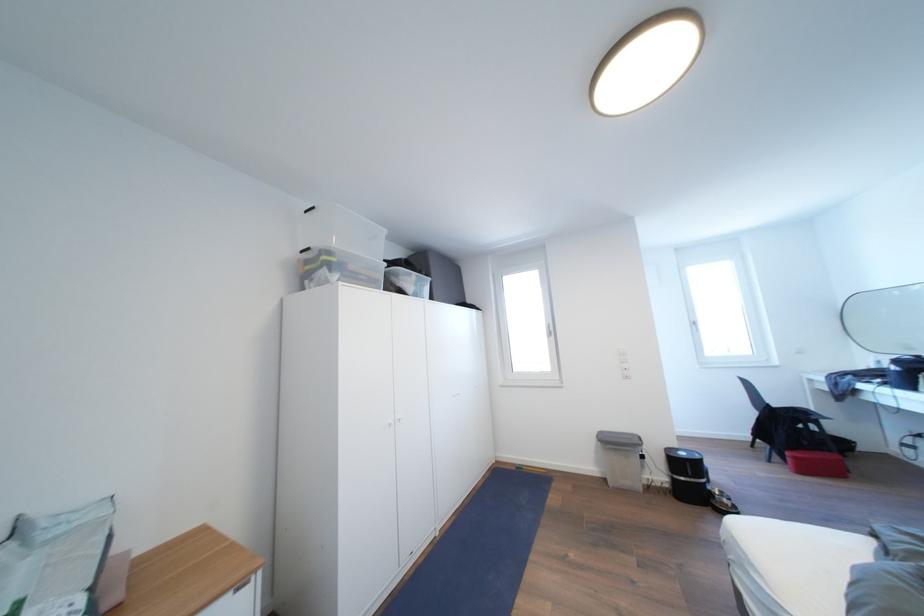
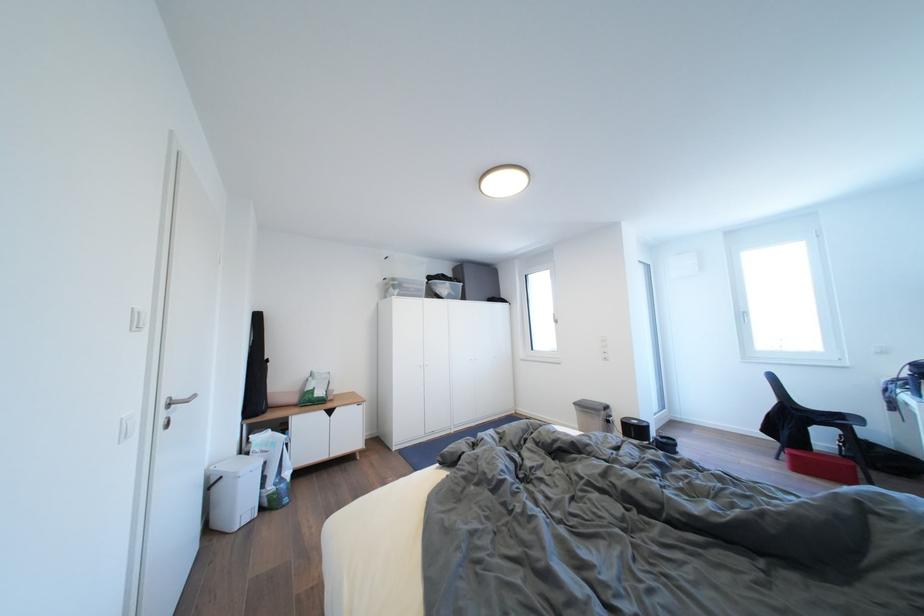
Which direction would the cameraman need to move to produce the second image?

The cameraman walked toward right, backward.